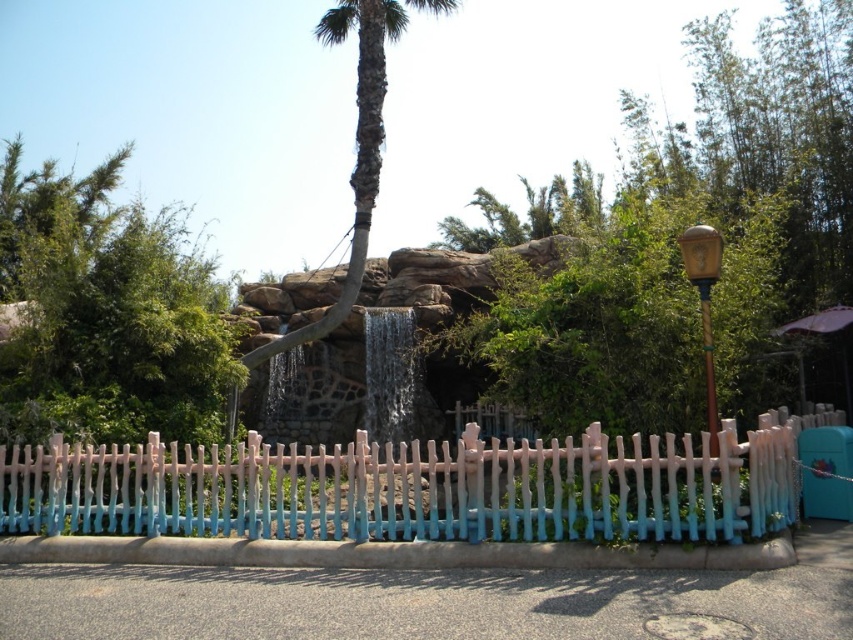
You are a visitor in the park and want to take a photo of both the green leafy tree at upper left and the green textured palm tree at center. Which tree should you move closer to in order to capture both in the frame?

You should move closer to the green textured palm tree at center because the green leafy tree at upper left is larger and will occupy more space in the frame, requiring you to adjust your position to include both.

You are a visitor at the park and want to take a photo of the pastel wood picket fence at lower center and the green leafy tree at upper left. Which object will appear closer to the camera in the photo?

The pastel wood picket fence at lower center will appear closer to the camera in the photo because it is positioned in front of the green leafy tree at upper left.

You are standing at the origin point in the image. Which direction should you move to reach the pastel wood picket fence at lower center?

The pastel wood picket fence at lower center is located at point 0.762 on the x axis and 0.490 on the y axis, so you should move to the right and slightly upwards to reach it.